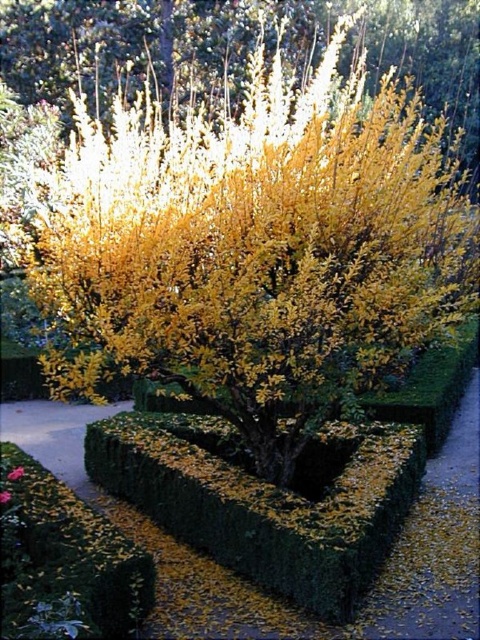
Question: Can you confirm if yellow leafy bush at upper center is positioned to the right of vivid pink petals at center?

Choices:
 (A) yes
 (B) no

Answer: (A)

Question: Does green hedge at center appear on the right side of vivid pink petal at center?

Choices:
 (A) yes
 (B) no

Answer: (A)

Question: Which object appears farthest from the camera in this image?

Choices:
 (A) yellow leafy bush at upper center
 (B) green hedge at center

Answer: (A)

Question: Among these points, which one is farthest from the camera?

Choices:
 (A) (268, 589)
 (B) (0, 499)

Answer: (B)

Question: Considering the relative positions of green hedge at center and vivid pink petal at center in the image provided, where is green hedge at center located with respect to vivid pink petal at center?

Choices:
 (A) above
 (B) below

Answer: (A)

Question: Which object is farther from the camera taking this photo?

Choices:
 (A) vivid pink petals at center
 (B) vivid pink petal at center
 (C) yellow leafy bush at upper center

Answer: (A)